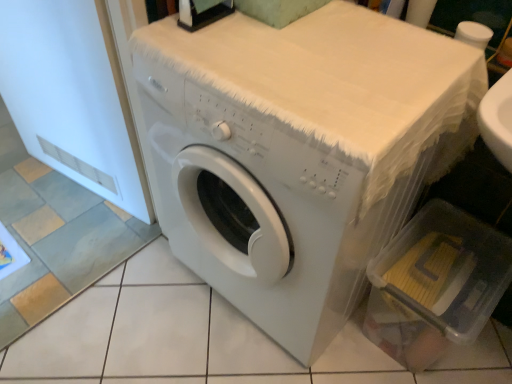
Question: Looking at their shapes, would you say white matte washing machine at center is wider or thinner than clear plastic container at lower right?

Choices:
 (A) wide
 (B) thin

Answer: (A)

Question: Visually, is white matte washing machine at center positioned to the left or to the right of clear plastic container at lower right?

Choices:
 (A) right
 (B) left

Answer: (B)

Question: Based on their relative distances, which object is nearer to the clear plastic container at lower right?

Choices:
 (A) white matte screen door at left
 (B) white matte washing machine at center

Answer: (B)

Question: Which object is the farthest from the white matte screen door at left?

Choices:
 (A) clear plastic container at lower right
 (B) white matte washing machine at center

Answer: (A)